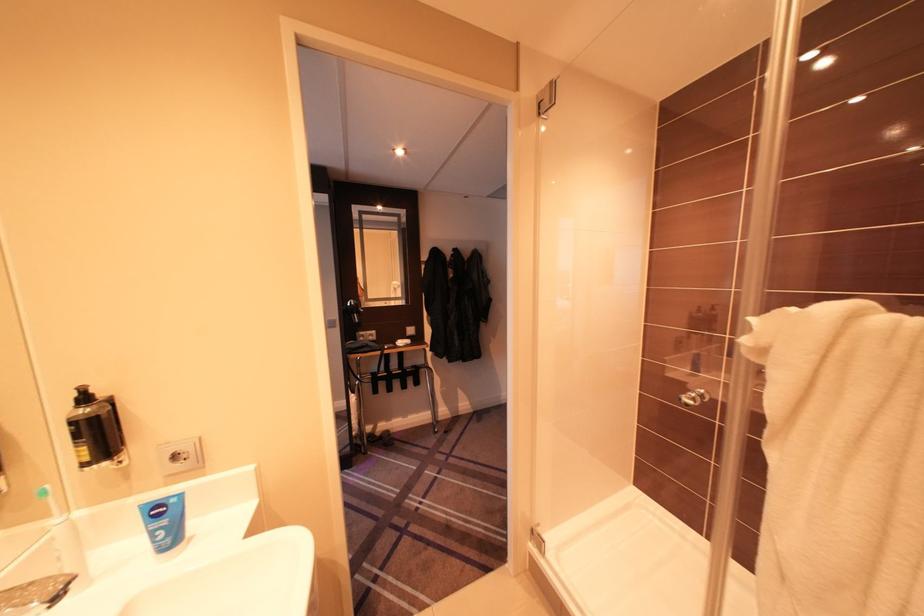
Find the location of a particular element. chrome shower knob is located at coordinates (694, 398).